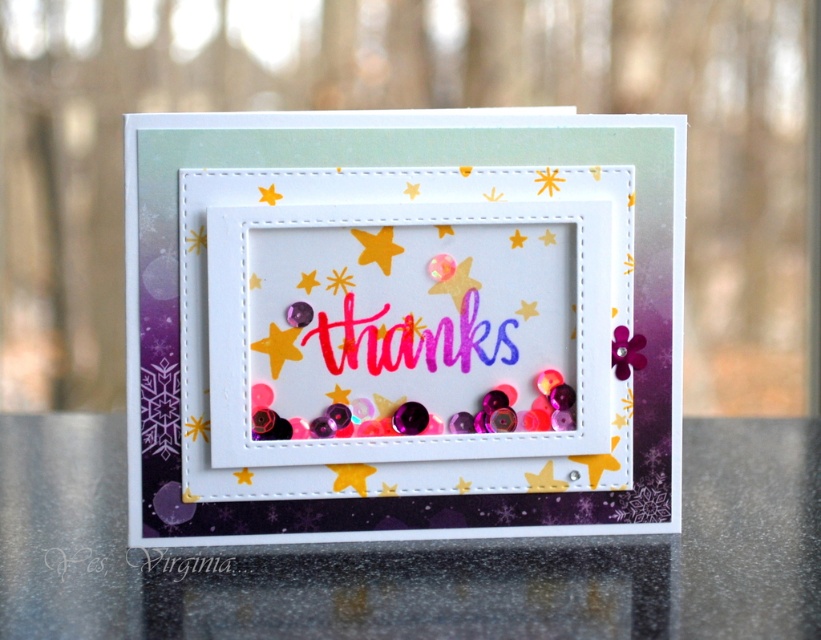
You are holding a camera and want to take a photo of the handmade greeting card. The camera is currently positioned at a distance where the point at coordinates point (76, 616) is 29.76 inches away. To ensure the entire card is in focus, you need to adjust your position so that the distance to this point becomes exactly 30 inches. Should you move closer to or farther away from the card?

The point (76, 616) is currently 29.76 inches away from the camera. To reach the desired distance of 30 inches, you should move slightly farther away from the card.